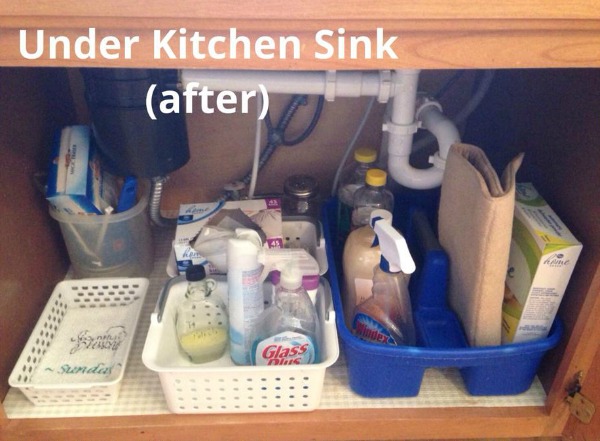
In order to click on white plastic storage bin in this screenshot , I will do `click(50, 399)`, `click(206, 399)`.